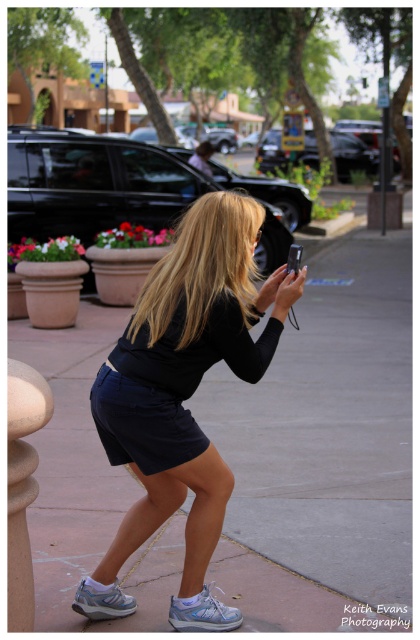
You are a fashion designer observing the woman in the scene. You need to determine if her black matte shorts at center can accommodate a matte black smartphone at center in one of the pockets. Based on the spatial relationship between these items, can the smartphone fit inside the shorts?

The black matte shorts at center are wider than the matte black smartphone at center, so the smartphone can fit inside the shorts as the shorts are wider.

What is the 2D coordinate of the black cotton dress at center in the image?

The black cotton dress at center is located at the 2D coordinates of point (170, 385).

You are a fashion designer observing the woman in the scene. You need to determine which item of clothing has a wider width between the black matte shorts at center and the black cotton dress at center based on the visual information provided. Which one is wider?

The black matte shorts at center has a larger width than the black cotton dress at center according to the description.